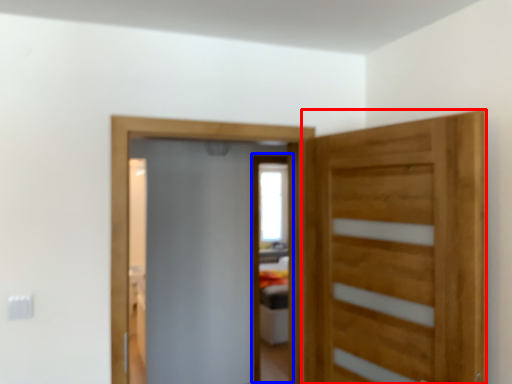
Question: Which point is closer to the camera, door (highlighted by a red box) or screen door (highlighted by a blue box)?

Choices:
 (A) door
 (B) screen door

Answer: (A)